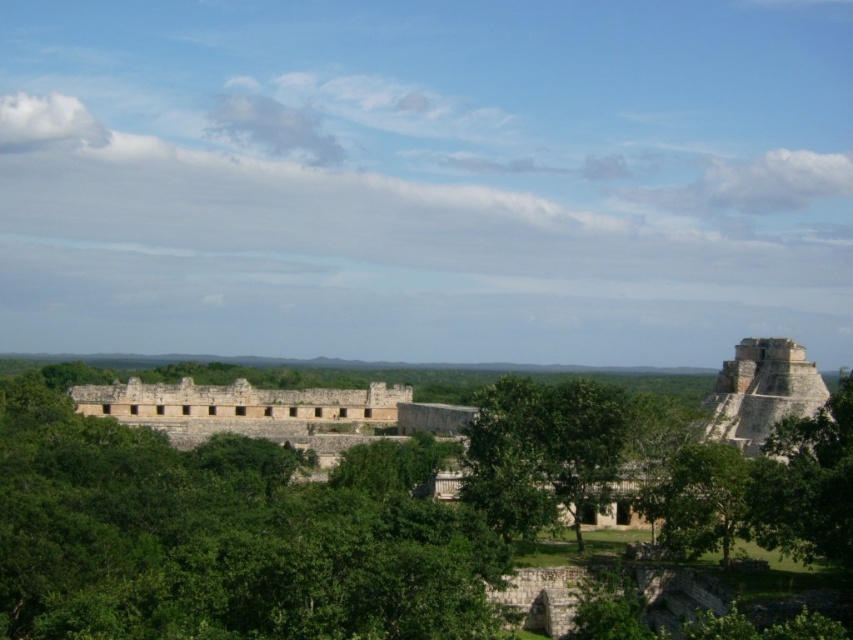
Between green leafy trees at center and green leafy tree at center, which one appears on the right side from the viewer's perspective?

green leafy tree at center

Does green leafy trees at center have a lesser width compared to green leafy tree at center?

No.

Is point (25, 506) in front of point (550, 385)?

That is True.

You are a GUI agent. You are given a task and a screenshot of the screen. Output one action in this format:
    pyautogui.click(x=<x>, y=<y>)
    Task: Click on the green leafy trees at center
    The height and width of the screenshot is (640, 853).
    Given the screenshot: What is the action you would take?
    pyautogui.click(x=218, y=540)